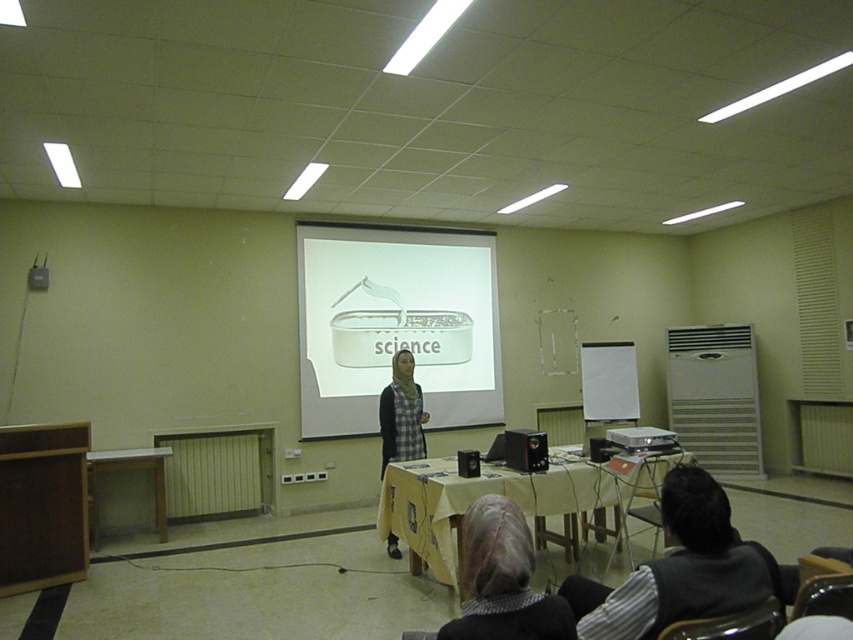
Locate an element on the screen. plaid fabric hijab at center is located at coordinates (401, 413).

Is point (425, 420) closer to viewer compared to point (618, 433)?

No, (425, 420) is behind (618, 433).

This screenshot has width=853, height=640. I want to click on plaid fabric hijab at center, so click(401, 413).

Who is higher up, wooden table at center or plaid fabric hijab at center?

plaid fabric hijab at center is higher up.

Which is behind, point (579, 518) or point (392, 394)?

The point (579, 518) is more distant.

Locate an element on the screen. wooden table at center is located at coordinates (630, 493).

Which is more to the left, black fabric at lower right or plaid fabric hijab at center?

From the viewer's perspective, plaid fabric hijab at center appears more on the left side.

Can you confirm if black fabric at lower right is taller than plaid fabric hijab at center?

No.

Is point (669, 538) more distant than point (422, 448)?

No, (669, 538) is in front of (422, 448).

Identify the location of black fabric at lower right. (677, 568).